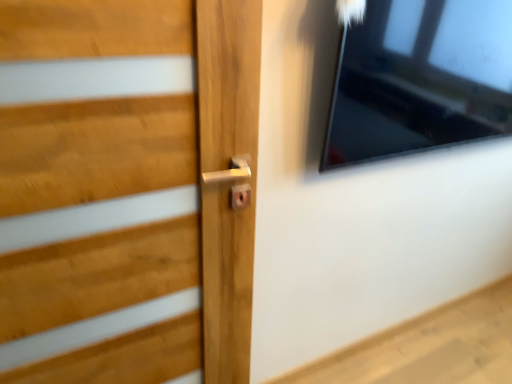
Where is `transparent glass window at upper right`? Image resolution: width=512 pixels, height=384 pixels. transparent glass window at upper right is located at coordinates [419, 79].

What do you see at coordinates (419, 79) in the screenshot?
I see `transparent glass window at upper right` at bounding box center [419, 79].

The image size is (512, 384). Describe the element at coordinates (125, 190) in the screenshot. I see `wooden door handle at center` at that location.

In order to face wooden door handle at center, should I rotate leftwards or rightwards?

Rotate left and turn 14.862 degrees.

Where is `wooden door handle at center`? This screenshot has width=512, height=384. wooden door handle at center is located at coordinates [x=125, y=190].

Find the location of `transparent glass window at upper right`. transparent glass window at upper right is located at coordinates (x=419, y=79).

Visually, is wooden door handle at center positioned to the left or to the right of transparent glass window at upper right?

In the image, wooden door handle at center appears on the left side of transparent glass window at upper right.

Considering the positions of objects wooden door handle at center and transparent glass window at upper right in the image provided, who is in front, wooden door handle at center or transparent glass window at upper right?

wooden door handle at center is closer to the camera.

Which point is more distant from viewer, (44,365) or (404,122)?

The point (404,122) is farther.

Consider the image. From the image's perspective, who appears lower, wooden door handle at center or transparent glass window at upper right?

wooden door handle at center, from the image's perspective.

From a real-world perspective, which object rests below the other?

wooden door handle at center, from a real-world perspective.

Which object is wider, wooden door handle at center or transparent glass window at upper right?

Wider between the two is transparent glass window at upper right.

Which of these two, wooden door handle at center or transparent glass window at upper right, stands taller?

With more height is wooden door handle at center.

Who is smaller, wooden door handle at center or transparent glass window at upper right?

wooden door handle at center.

Do you think wooden door handle at center is within transparent glass window at upper right, or outside of it?

wooden door handle at center is outside transparent glass window at upper right.

Would you say wooden door handle at center is a long distance from transparent glass window at upper right?

No, wooden door handle at center is not far away from transparent glass window at upper right.

Could you tell me if wooden door handle at center is facing transparent glass window at upper right?

No, wooden door handle at center is not aimed at transparent glass window at upper right.

How far apart are wooden door handle at center and transparent glass window at upper right?

A distance of 72.15 centimeters exists between wooden door handle at center and transparent glass window at upper right.

Find the location of a particular element. This screenshot has height=384, width=512. door below the transparent glass window at upper right (from a real-world perspective) is located at coordinates (125, 190).

Visually, is transparent glass window at upper right positioned to the left or to the right of wooden door handle at center?

Based on their positions, transparent glass window at upper right is located to the right of wooden door handle at center.

Between transparent glass window at upper right and wooden door handle at center, which one is positioned behind?

transparent glass window at upper right is further away from the camera.

Is point (360, 122) closer to viewer compared to point (0, 133)?

No.

From the image's perspective, is transparent glass window at upper right positioned above or below wooden door handle at center?

transparent glass window at upper right is above wooden door handle at center.

From a real-world perspective, is transparent glass window at upper right above or below wooden door handle at center?

A: Clearly, from a real-world perspective, transparent glass window at upper right is above wooden door handle at center.

Is transparent glass window at upper right wider or thinner than wooden door handle at center?

Considering their sizes, transparent glass window at upper right looks broader than wooden door handle at center.

Looking at this image, which of these two, transparent glass window at upper right or wooden door handle at center, stands taller?

wooden door handle at center.

In the scene shown: Who is bigger, transparent glass window at upper right or wooden door handle at center?

transparent glass window at upper right.

Would you say transparent glass window at upper right is inside or outside wooden door handle at center?

transparent glass window at upper right is located beyond the bounds of wooden door handle at center.

Would you say transparent glass window at upper right is a long distance from wooden door handle at center?

No, there isn't a large distance between transparent glass window at upper right and wooden door handle at center.

Is transparent glass window at upper right turned away from wooden door handle at center?

No.

Where is `window above the wooden door handle at center (from a real-world perspective)`? This screenshot has width=512, height=384. window above the wooden door handle at center (from a real-world perspective) is located at coordinates (419, 79).

Locate an element on the screen. This screenshot has height=384, width=512. door on the left of transparent glass window at upper right is located at coordinates (125, 190).

Where is `door below the transparent glass window at upper right (from the image's perspective)`? The image size is (512, 384). door below the transparent glass window at upper right (from the image's perspective) is located at coordinates (125, 190).